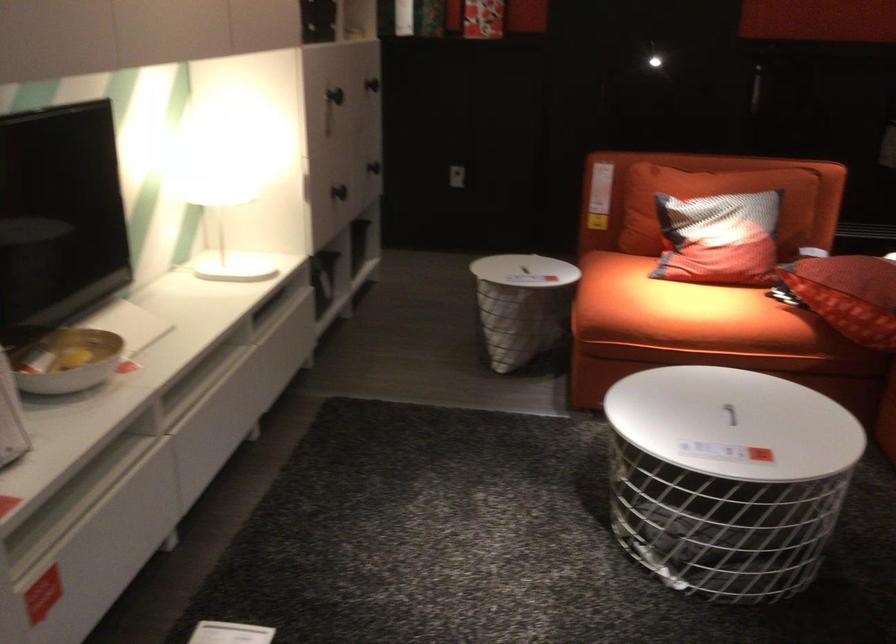
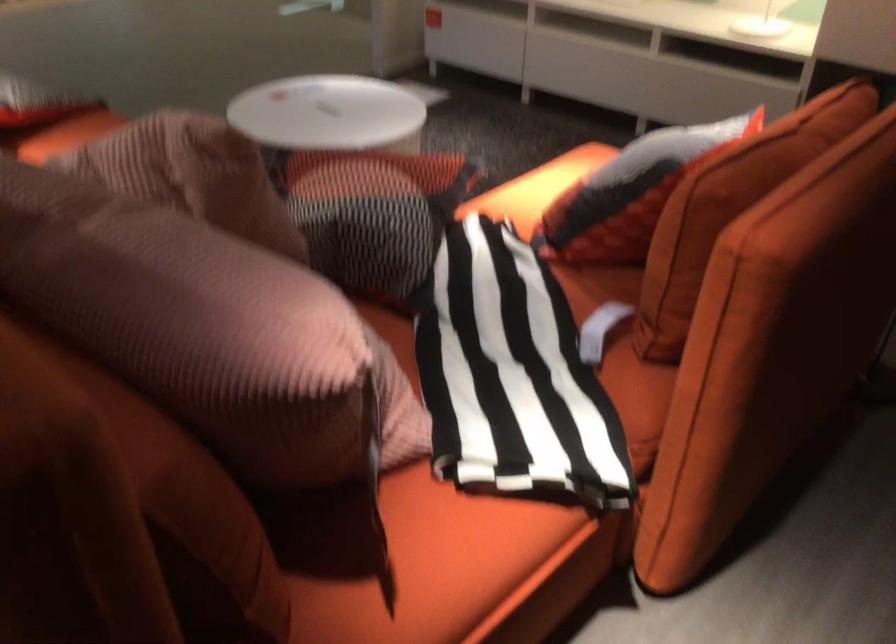
Where in the second image is the point corresponding to pixel 819 164 from the first image?

(730, 207)